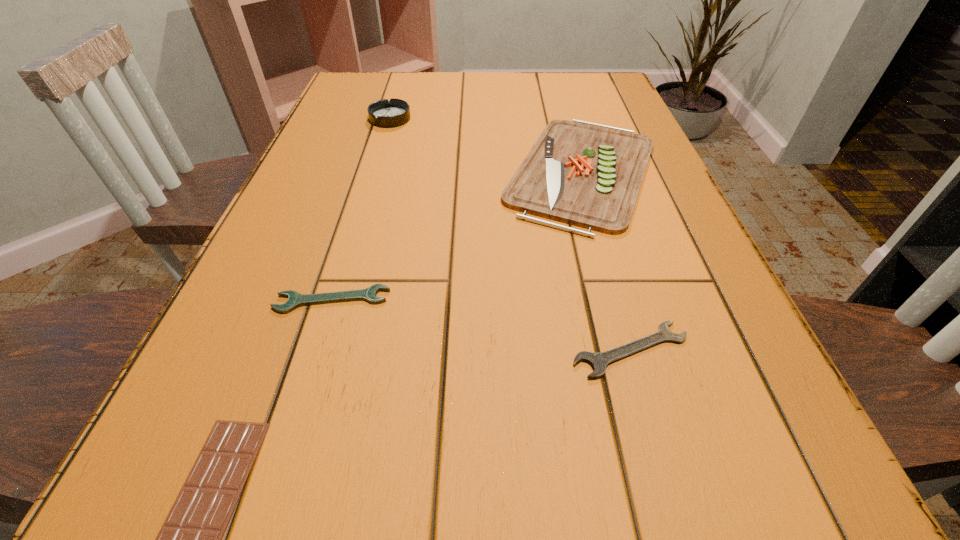
At what (x,y) coordinates should I click in order to perform the action: click on ashtray. Please return your answer as a coordinate pair (x, y). Looking at the image, I should click on (382, 113).

Locate an element on the screen. The height and width of the screenshot is (540, 960). chopping board is located at coordinates (580, 173).

Identify the location of the farther wrench. (295, 299).

Locate an element on the screen. The height and width of the screenshot is (540, 960). the left wrench is located at coordinates (295, 299).

Image resolution: width=960 pixels, height=540 pixels. I want to click on the nearer wrench, so click(x=599, y=361).

Where is `the second nearest object`? the second nearest object is located at coordinates (599, 361).

You are a GUI agent. You are given a task and a screenshot of the screen. Output one action in this format:
    pyautogui.click(x=<x>, y=<y>)
    Task: Click on the free location located 0.140m on the right of the ashtray
    Image resolution: width=960 pixels, height=540 pixels.
    Given the screenshot: What is the action you would take?
    pyautogui.click(x=466, y=118)

Find the location of a particular element. The image size is (960, 540). vacant region located on the left of the chopping board is located at coordinates (394, 171).

Image resolution: width=960 pixels, height=540 pixels. I want to click on vacant space located 0.210m on the right of the farther wrench, so click(x=520, y=300).

Where is `vacant space located on the back of the second nearest object`? The width and height of the screenshot is (960, 540). vacant space located on the back of the second nearest object is located at coordinates (602, 248).